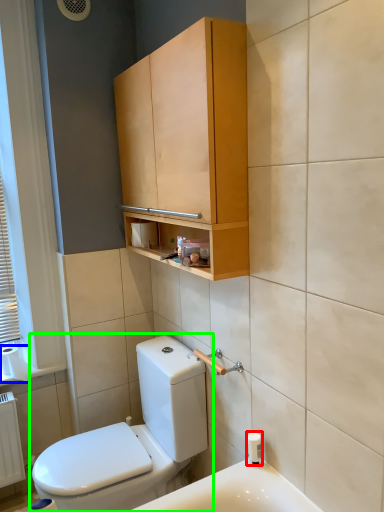
Question: Which object is positioned farthest from toiletry (highlighted by a red box)? Select from to paper (highlighted by a blue box) and toilet (highlighted by a green box).

Choices:
 (A) to paper
 (B) toilet

Answer: (A)